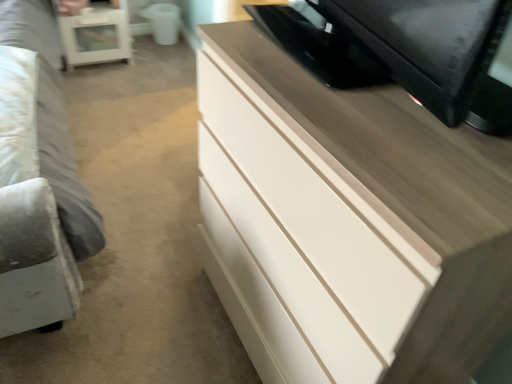
This screenshot has width=512, height=384. What are the coordinates of `white glossy side table at upper left` in the screenshot? It's located at (96, 36).

Describe the element at coordinates (96, 36) in the screenshot. The height and width of the screenshot is (384, 512). I see `white glossy side table at upper left` at that location.

The image size is (512, 384). What are the coordinates of `white glossy chest of drawers at upper right` in the screenshot? It's located at (348, 222).

Measure the distance between white glossy chest of drawers at upper right and camera.

white glossy chest of drawers at upper right is 20.47 inches away from camera.

This screenshot has height=384, width=512. What do you see at coordinates (348, 222) in the screenshot? I see `white glossy chest of drawers at upper right` at bounding box center [348, 222].

Find the location of a particular element. The height and width of the screenshot is (384, 512). white glossy side table at upper left is located at coordinates (96, 36).

Which is more to the right, white glossy side table at upper left or white glossy chest of drawers at upper right?

white glossy chest of drawers at upper right is more to the right.

Consider the image. Relative to white glossy chest of drawers at upper right, is white glossy side table at upper left in front or behind?

Clearly, white glossy side table at upper left is behind white glossy chest of drawers at upper right.

Between point (85, 38) and point (298, 269), which one is positioned behind?

The point (85, 38) is farther.

From the image's perspective, between white glossy side table at upper left and white glossy chest of drawers at upper right, which one is located above?

white glossy side table at upper left.

In the scene shown: From a real-world perspective, is white glossy side table at upper left below white glossy chest of drawers at upper right?

Yes, from a real-world perspective, white glossy side table at upper left is under white glossy chest of drawers at upper right.

Does white glossy side table at upper left have a lesser width compared to white glossy chest of drawers at upper right?

Yes.

In terms of height, does white glossy side table at upper left look taller or shorter compared to white glossy chest of drawers at upper right?

In the image, white glossy side table at upper left appears to be shorter than white glossy chest of drawers at upper right.

Is white glossy side table at upper left smaller than white glossy chest of drawers at upper right?

Yes, white glossy side table at upper left is smaller than white glossy chest of drawers at upper right.

Is white glossy side table at upper left positioned beyond the bounds of white glossy chest of drawers at upper right?

Yes, white glossy side table at upper left is located beyond the bounds of white glossy chest of drawers at upper right.

Is white glossy side table at upper left touching white glossy chest of drawers at upper right?

No, white glossy side table at upper left is not next to white glossy chest of drawers at upper right.

Does white glossy side table at upper left turn towards white glossy chest of drawers at upper right?

Yes, white glossy side table at upper left is turned towards white glossy chest of drawers at upper right.

How many degrees apart are the facing directions of white glossy side table at upper left and white glossy chest of drawers at upper right?

The angle between the facing direction of white glossy side table at upper left and the facing direction of white glossy chest of drawers at upper right is 88.3 degrees.

Identify the location of table lying above the white glossy chest of drawers at upper right (from the image's perspective). This screenshot has width=512, height=384. (96, 36).

Consider the image. Considering the positions of objects white glossy chest of drawers at upper right and white glossy side table at upper left in the image provided, who is more to the left, white glossy chest of drawers at upper right or white glossy side table at upper left?

From the viewer's perspective, white glossy side table at upper left appears more on the left side.

Which object is further away from the camera taking this photo, white glossy chest of drawers at upper right or white glossy side table at upper left?

white glossy side table at upper left.

Considering the positions of points (376, 154) and (59, 16), is point (376, 154) farther from camera compared to point (59, 16)?

No, (376, 154) is in front of (59, 16).

From the image's perspective, is white glossy chest of drawers at upper right below white glossy side table at upper left?

Yes.

From a real-world perspective, which is physically below, white glossy chest of drawers at upper right or white glossy side table at upper left?

white glossy side table at upper left.

Is white glossy chest of drawers at upper right wider or thinner than white glossy side table at upper left?

white glossy chest of drawers at upper right is wider than white glossy side table at upper left.

Does white glossy chest of drawers at upper right have a greater height compared to white glossy side table at upper left?

Indeed, white glossy chest of drawers at upper right has a greater height compared to white glossy side table at upper left.

Considering the sizes of objects white glossy chest of drawers at upper right and white glossy side table at upper left in the image provided, who is smaller, white glossy chest of drawers at upper right or white glossy side table at upper left?

With smaller size is white glossy side table at upper left.

Which is correct: white glossy chest of drawers at upper right is inside white glossy side table at upper left, or outside of it?

white glossy chest of drawers at upper right is located beyond the bounds of white glossy side table at upper left.

Is white glossy chest of drawers at upper right far away from white glossy side table at upper left?

Yes, white glossy chest of drawers at upper right and white glossy side table at upper left are quite far apart.

Is white glossy chest of drawers at upper right oriented away from white glossy side table at upper left?

white glossy chest of drawers at upper right is not turned away from white glossy side table at upper left.

You are a GUI agent. You are given a task and a screenshot of the screen. Output one action in this format:
    pyautogui.click(x=<x>, y=<y>)
    Task: Click on the table below the white glossy chest of drawers at upper right (from a real-world perspective)
    The width and height of the screenshot is (512, 384).
    Given the screenshot: What is the action you would take?
    pyautogui.click(x=96, y=36)

Find the location of `table on the left of white glossy chest of drawers at upper right`. table on the left of white glossy chest of drawers at upper right is located at coordinates (96, 36).

Locate an element on the screen. This screenshot has width=512, height=384. the chest of drawers in front of the white glossy side table at upper left is located at coordinates (348, 222).